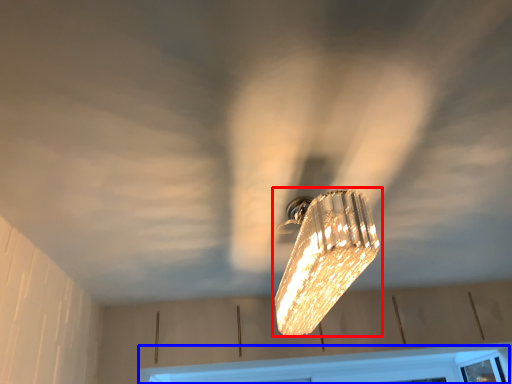
Question: Which of the following is the farthest to the observer, lamp (highlighted by a red box) or window frame (highlighted by a blue box)?

Choices:
 (A) lamp
 (B) window frame

Answer: (B)